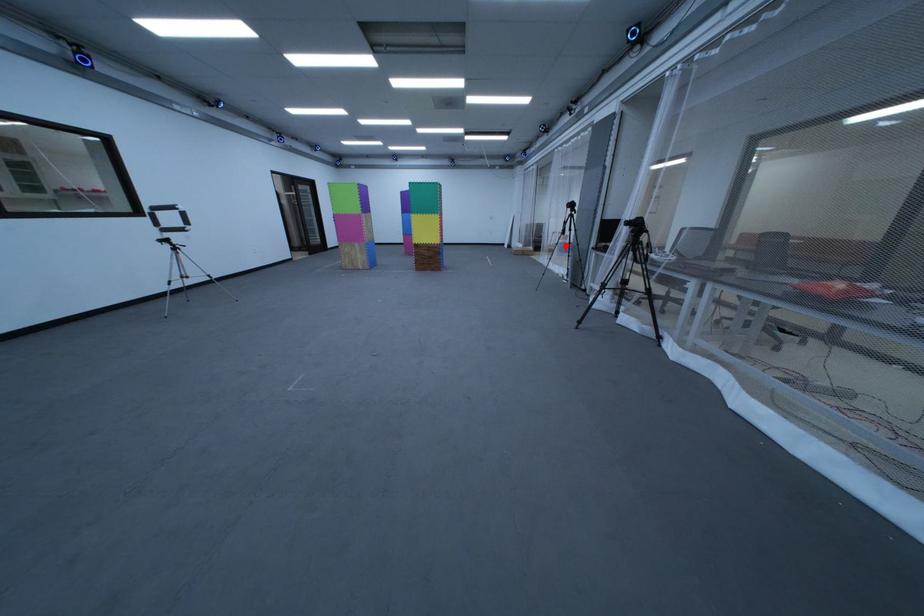
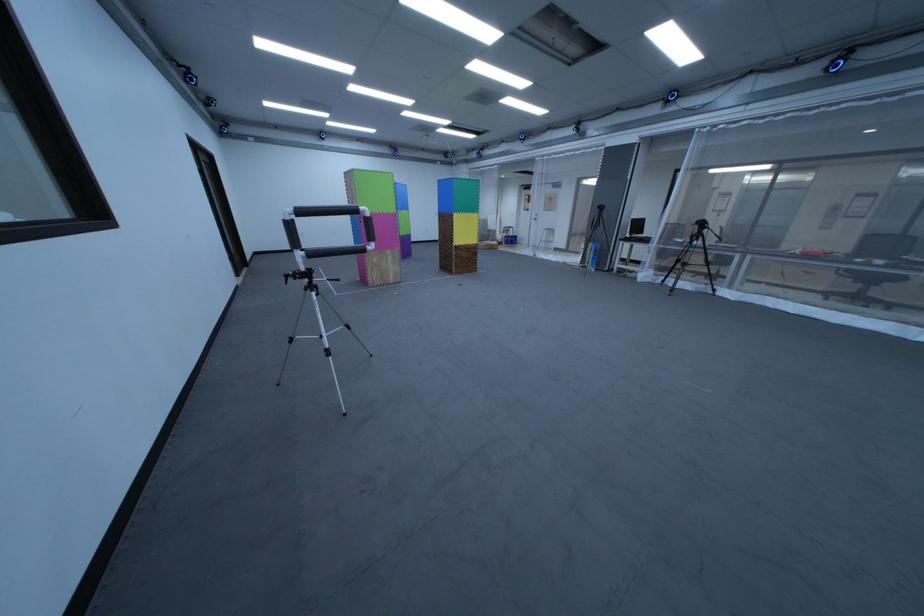
Question: I am providing you with two images of the same scene from different viewpoints. In image1, a red point is highlighted. Considering the same 3D point in image2, which of the following is correct?

Choices:
 (A) It is closer
 (B) It is farther

Answer: (A)